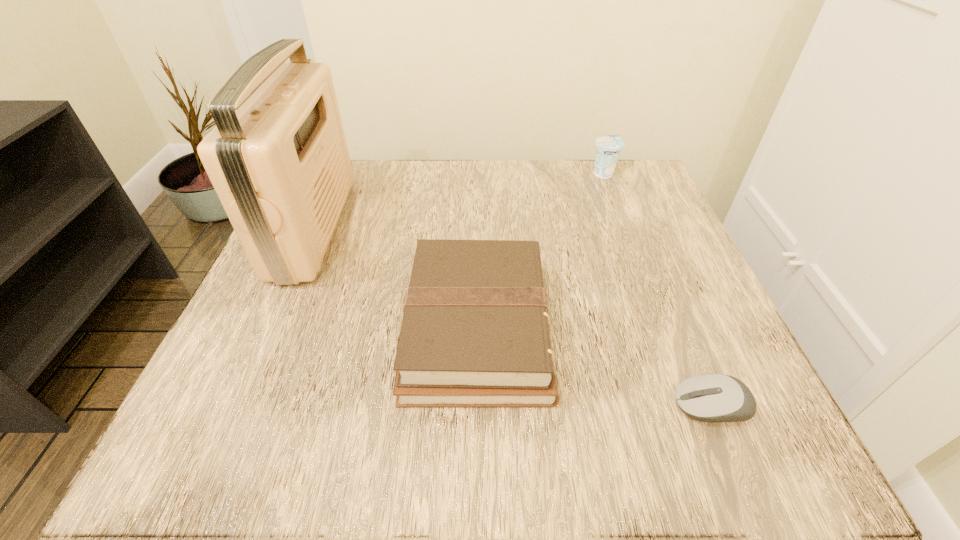
Identify the location of the tallest object. Image resolution: width=960 pixels, height=540 pixels. (278, 159).

I want to click on the leftmost object, so click(x=278, y=159).

Where is `yogurt`? The width and height of the screenshot is (960, 540). yogurt is located at coordinates (608, 148).

Locate an element on the screen. This screenshot has width=960, height=540. Bible is located at coordinates (475, 332).

The width and height of the screenshot is (960, 540). I want to click on the shortest object, so click(x=711, y=397).

At what (x,y) coordinates should I click in order to perform the action: click on free region located 0.310m on the front-facing side of the radio receiver. Please return your answer as a coordinate pair (x, y). This screenshot has height=540, width=960. Looking at the image, I should click on (492, 227).

The height and width of the screenshot is (540, 960). Identify the location of free space located 0.090m on the front of the yogurt. (614, 203).

At what (x,y) coordinates should I click in order to perform the action: click on vacant space located 0.120m on the spine side of the third object from right to left. Please return your answer as a coordinate pair (x, y). This screenshot has height=540, width=960. Looking at the image, I should click on (622, 329).

Locate an element on the screen. This screenshot has height=540, width=960. vacant space located on the wheel side of the computer equipment is located at coordinates (429, 406).

In order to click on vacant space located 0.330m on the wheel side of the computer equipment in this screenshot , I will do `click(437, 406)`.